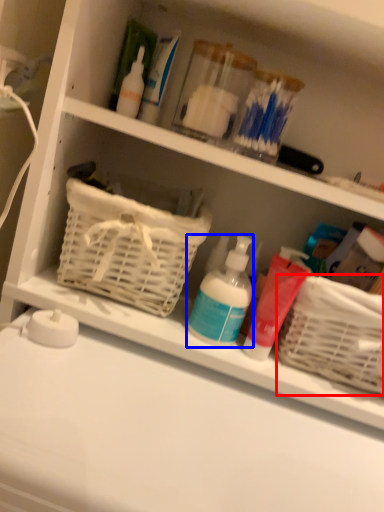
Question: Which of the following is the closest to the observer, basket (highlighted by a red box) or cleaning product (highlighted by a blue box)?

Choices:
 (A) basket
 (B) cleaning product

Answer: (A)